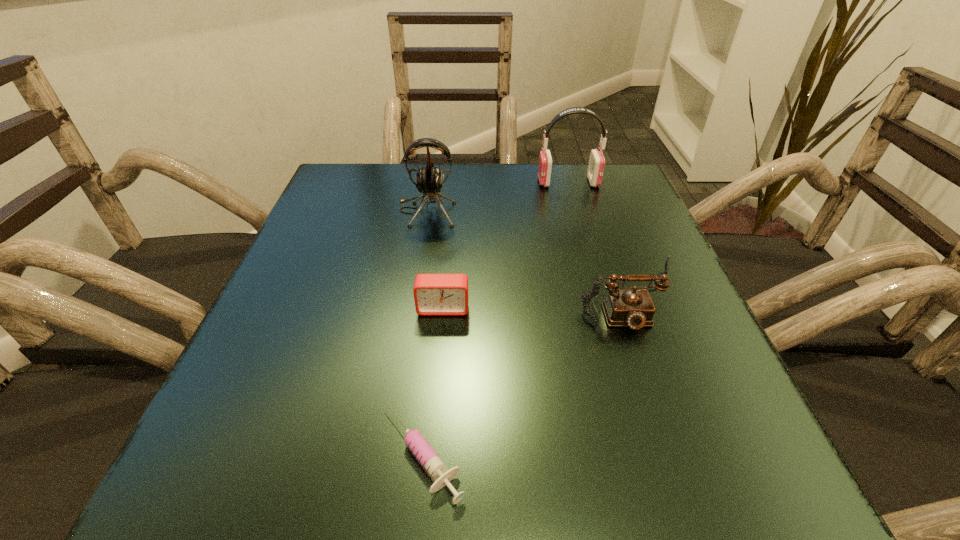
Find the location of a particular element. This screenshot has width=960, height=540. the farther earphone is located at coordinates (596, 165).

Locate an element on the screen. the farthest object is located at coordinates (596, 165).

Locate an element on the screen. The image size is (960, 540). the nearer earphone is located at coordinates (429, 180).

At what (x,y) coordinates should I click in order to perform the action: click on the left earphone. Please return your answer as a coordinate pair (x, y). This screenshot has width=960, height=540. Looking at the image, I should click on (429, 180).

Find the location of a particular element. telephone is located at coordinates (633, 308).

Locate an element on the screen. This screenshot has width=960, height=540. the second shortest object is located at coordinates coord(435,294).

You are a GUI agent. You are given a task and a screenshot of the screen. Output one action in this format:
    pyautogui.click(x=<x>, y=<y>)
    Task: Click on the shortest object
    
    Given the screenshot: What is the action you would take?
    pyautogui.click(x=432, y=463)

Find the location of a particular element. syringe is located at coordinates (432, 463).

This screenshot has height=540, width=960. In order to click on free space located 0.140m on the outer surface of the right earphone in this screenshot , I will do `click(480, 182)`.

Where is `vacant space located on the outer surface of the right earphone`? The image size is (960, 540). vacant space located on the outer surface of the right earphone is located at coordinates (514, 182).